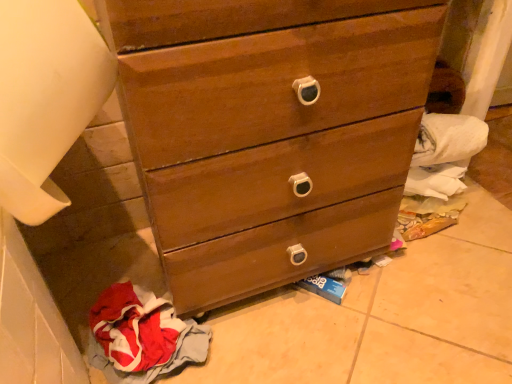
Describe the element at coordinates (270, 132) in the screenshot. I see `wooden chest of drawers at center` at that location.

The height and width of the screenshot is (384, 512). I want to click on wooden chest of drawers at center, so click(x=270, y=132).

This screenshot has width=512, height=384. What do you see at coordinates (141, 336) in the screenshot?
I see `red cotton cloth at lower left` at bounding box center [141, 336].

This screenshot has width=512, height=384. I want to click on red cotton cloth at lower left, so click(x=141, y=336).

Where is `wooden chest of drawers at center`? This screenshot has height=384, width=512. wooden chest of drawers at center is located at coordinates (270, 132).

Which object is positioned more to the left, red cotton cloth at lower left or wooden chest of drawers at center?

From the viewer's perspective, red cotton cloth at lower left appears more on the left side.

In the image, is red cotton cloth at lower left positioned in front of or behind wooden chest of drawers at center?

red cotton cloth at lower left is positioned farther from the viewer than wooden chest of drawers at center.

Which point is more distant from viewer, (116, 365) or (224, 70)?

Positioned behind is point (116, 365).

From the image's perspective, relative to wooden chest of drawers at center, is red cotton cloth at lower left above or below?

red cotton cloth at lower left is situated lower than wooden chest of drawers at center in the image.

From a real-world perspective, is red cotton cloth at lower left physically located above or below wooden chest of drawers at center?

red cotton cloth at lower left is below wooden chest of drawers at center.

Does red cotton cloth at lower left have a greater width compared to wooden chest of drawers at center?

No, red cotton cloth at lower left is not wider than wooden chest of drawers at center.

Is red cotton cloth at lower left shorter than wooden chest of drawers at center?

Yes, red cotton cloth at lower left is shorter than wooden chest of drawers at center.

Considering the relative sizes of red cotton cloth at lower left and wooden chest of drawers at center in the image provided, is red cotton cloth at lower left smaller than wooden chest of drawers at center?

Indeed, red cotton cloth at lower left has a smaller size compared to wooden chest of drawers at center.

Is red cotton cloth at lower left not inside wooden chest of drawers at center?

Indeed, red cotton cloth at lower left is completely outside wooden chest of drawers at center.

Consider the image. Are red cotton cloth at lower left and wooden chest of drawers at center beside each other?

No, red cotton cloth at lower left is not in contact with wooden chest of drawers at center.

Is red cotton cloth at lower left positioned with its back to wooden chest of drawers at center?

No, red cotton cloth at lower left's orientation is not away from wooden chest of drawers at center.

This screenshot has height=384, width=512. What are the coordinates of `chest of drawers on the right side of red cotton cloth at lower left` in the screenshot? It's located at (270, 132).

Which is more to the right, wooden chest of drawers at center or red cotton cloth at lower left?

wooden chest of drawers at center is more to the right.

Based on the photo, is wooden chest of drawers at center in front of or behind red cotton cloth at lower left in the image?

wooden chest of drawers at center is positioned closer to the viewer than red cotton cloth at lower left.

Which is less distant, [242,139] or [153,342]?

Point [242,139]

From the image's perspective, does wooden chest of drawers at center appear higher than red cotton cloth at lower left?

Yes, from the image's perspective, wooden chest of drawers at center is on top of red cotton cloth at lower left.

From a real-world perspective, between wooden chest of drawers at center and red cotton cloth at lower left, who is vertically higher?

From a 3D spatial view, wooden chest of drawers at center is above.

Does wooden chest of drawers at center have a lesser width compared to red cotton cloth at lower left?

No.

Is wooden chest of drawers at center shorter than red cotton cloth at lower left?

In fact, wooden chest of drawers at center may be taller than red cotton cloth at lower left.

Does wooden chest of drawers at center have a smaller size compared to red cotton cloth at lower left?

No, wooden chest of drawers at center is not smaller than red cotton cloth at lower left.

Would you say wooden chest of drawers at center is outside red cotton cloth at lower left?

Yes, wooden chest of drawers at center is located beyond the bounds of red cotton cloth at lower left.

Is wooden chest of drawers at center touching red cotton cloth at lower left?

No, wooden chest of drawers at center is not touching red cotton cloth at lower left.

Is wooden chest of drawers at center facing towards red cotton cloth at lower left?

No, wooden chest of drawers at center is not facing towards red cotton cloth at lower left.

Measure the distance between wooden chest of drawers at center and red cotton cloth at lower left.

wooden chest of drawers at center and red cotton cloth at lower left are 13.00 inches apart from each other.

Locate an element on the screen. This screenshot has height=384, width=512. baby clothe that is behind the wooden chest of drawers at center is located at coordinates (141, 336).

The image size is (512, 384). What are the coordinates of `chest of drawers in front of the red cotton cloth at lower left` in the screenshot? It's located at (270, 132).

You are a GUI agent. You are given a task and a screenshot of the screen. Output one action in this format:
    pyautogui.click(x=<x>, y=<y>)
    Task: Click on the chest of drawers that appears above the red cotton cloth at lower left (from a real-world perspective)
    This screenshot has height=384, width=512.
    Given the screenshot: What is the action you would take?
    pyautogui.click(x=270, y=132)